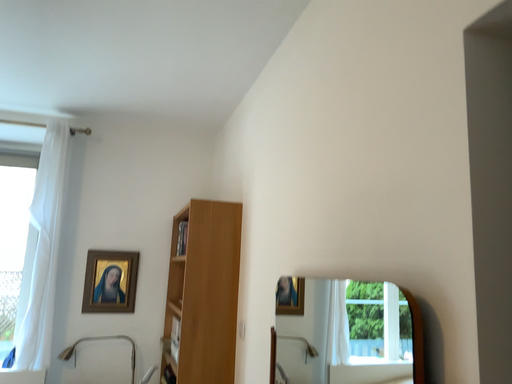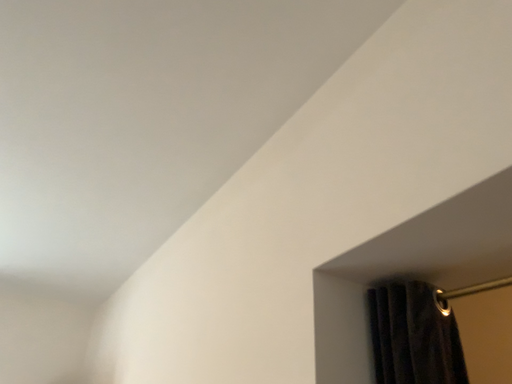
Question: Which way did the camera rotate in the video?

Choices:
 (A) rotated left
 (B) rotated right

Answer: (B)